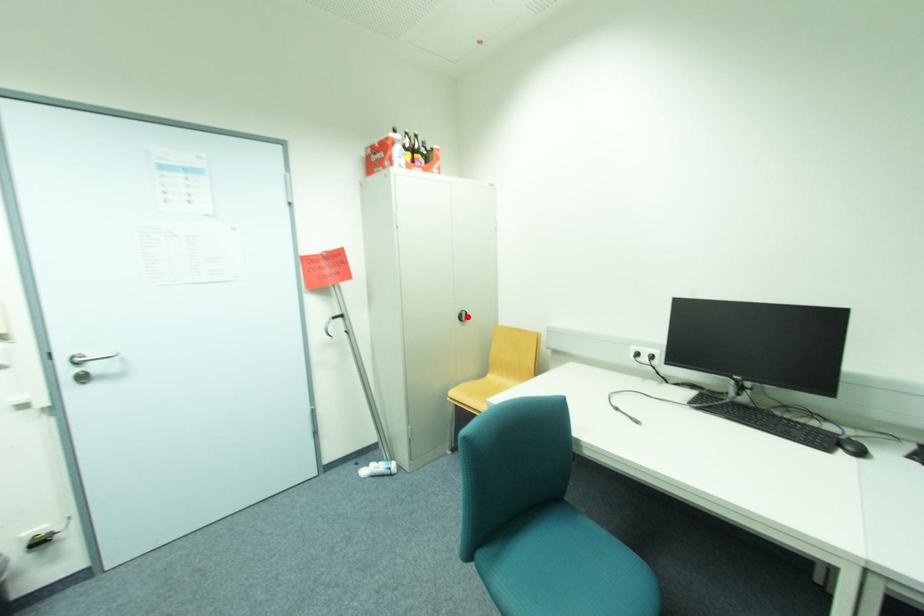
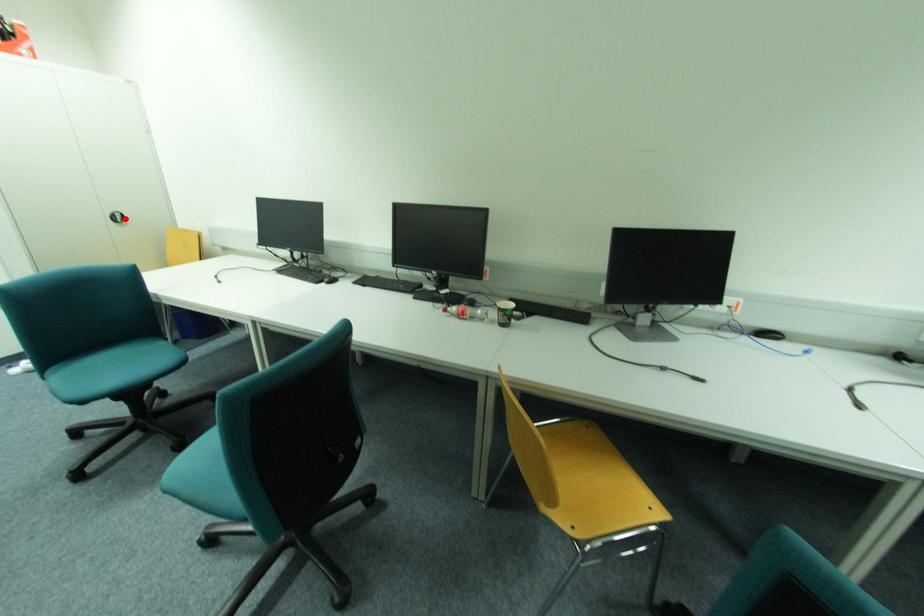
I am providing you with two images of the same scene from different viewpoints. A red point is marked on the first image and another point is marked on the second image. Does the point marked in image1 correspond to the same location as the one in image2?

Yes